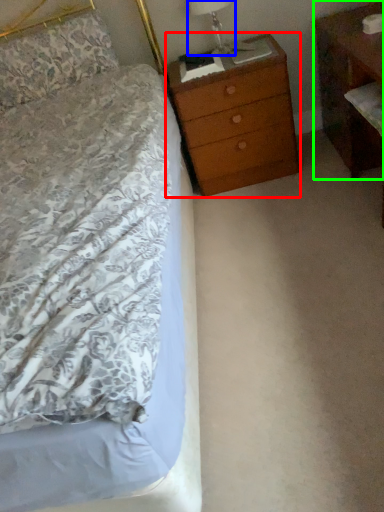
Question: Which object is positioned closest to chest of drawers (highlighted by a red box)? Select from bedside lamp (highlighted by a blue box) and nightstand (highlighted by a green box).

Choices:
 (A) bedside lamp
 (B) nightstand

Answer: (A)